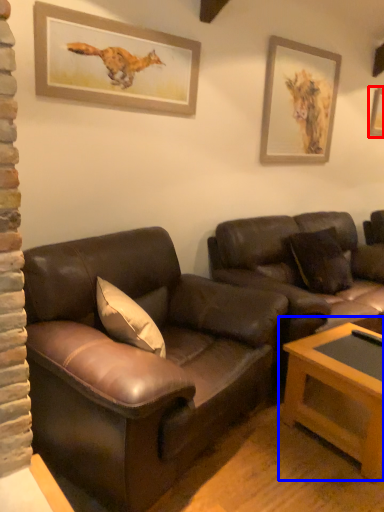
Question: Which point is further to the camera, picture frame (highlighted by a red box) or table (highlighted by a blue box)?

Choices:
 (A) picture frame
 (B) table

Answer: (A)